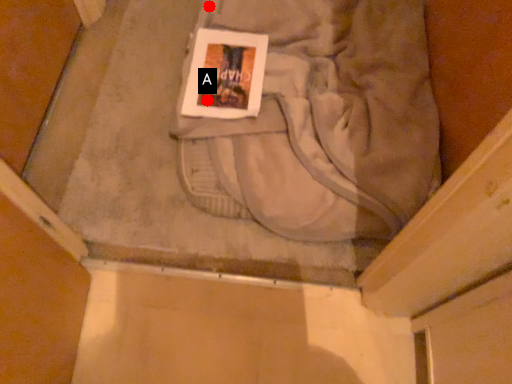
Question: Two points are circled on the image, labeled by A and B beside each circle. Which of the following is the closest to the observer?

Choices:
 (A) A is closer
 (B) B is closer

Answer: (A)